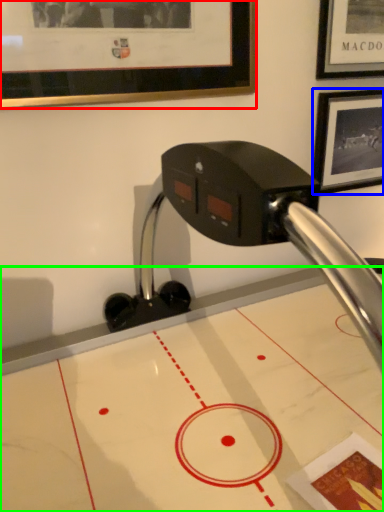
Question: Estimate the real-world distances between objects in this image. Which object is farther from picture frame (highlighted by a red box), picture frame (highlighted by a blue box) or table (highlighted by a green box)?

Choices:
 (A) picture frame
 (B) table

Answer: (B)